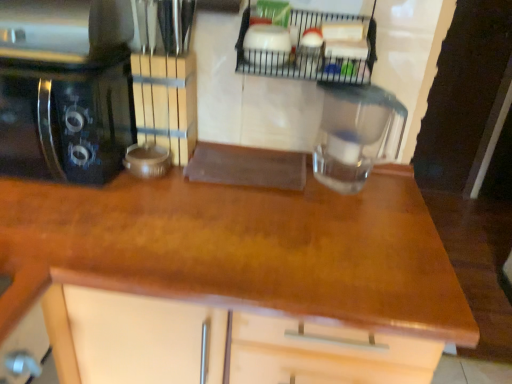
Question: From a real-world perspective, is wooden at center physically located above or below transparent glass jar at center?

Choices:
 (A) above
 (B) below

Answer: (B)

Question: Visually, is wooden at center positioned to the left or to the right of transparent glass jar at center?

Choices:
 (A) right
 (B) left

Answer: (B)

Question: Which object is the closest to the black glossy coffee maker at left?

Choices:
 (A) metallic wire rack at upper center
 (B) wooden at center
 (C) transparent glass jar at center

Answer: (B)

Question: Estimate the real-world distances between objects in this image. Which object is closer to the wooden at center?

Choices:
 (A) transparent glass jar at center
 (B) metallic wire rack at upper center
 (C) black glossy coffee maker at left

Answer: (A)